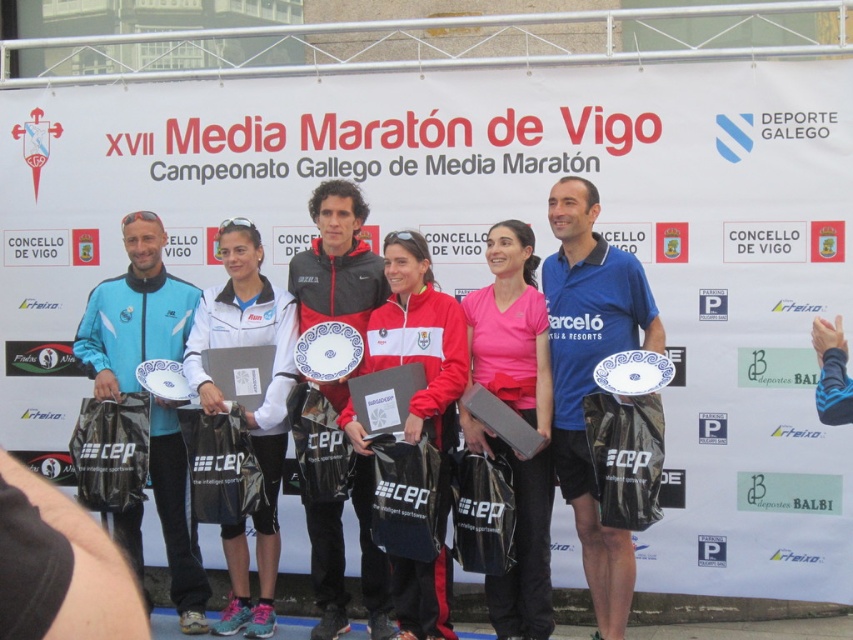
From the picture: Does white matte jacket at center have a lesser width compared to red and white jacket at center?

Incorrect, white matte jacket at center's width is not less than red and white jacket at center's.

Is point (280, 289) more distant than point (440, 337)?

Yes, it is.

Locate an element on the screen. The width and height of the screenshot is (853, 640). white matte jacket at center is located at coordinates (248, 410).

Does red and black jacket at center lie in front of red and white jacket at center?

No, red and black jacket at center is behind red and white jacket at center.

Is point (363, 208) less distant than point (444, 324)?

No, (363, 208) is behind (444, 324).

Where is `red and black jacket at center`? red and black jacket at center is located at coordinates (335, 262).

Between blue fabric shirt at center and red and white jacket at center, which one has more height?

blue fabric shirt at center

Can you confirm if blue fabric shirt at center is thinner than red and white jacket at center?

Incorrect, blue fabric shirt at center's width is not less than red and white jacket at center's.

Looking at this image, measure the distance between point (628,260) and camera.

Point (628,260) is 6.34 meters from camera.

Find the location of a particular element. blue fabric shirt at center is located at coordinates (590, 376).